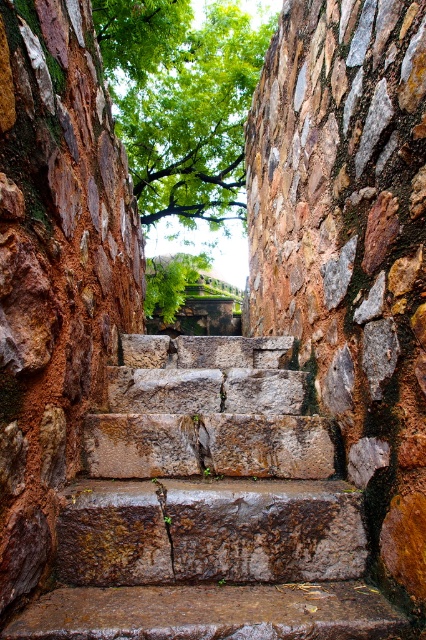
You are standing at the entrance of the staircase and want to reach the top. Based on the location of the rusty stone stairs at center, which direction should you move to ascend?

The rusty stone stairs at center are located at coordinates point (x=209, y=508), so you should move towards the center to ascend the stairs.

You are standing at the bottom of the rusty stone stairs at center and looking up. There is a green leafy tree at upper center above you. Which object is taller?

The green leafy tree at upper center is taller than the rusty stone stairs at center.